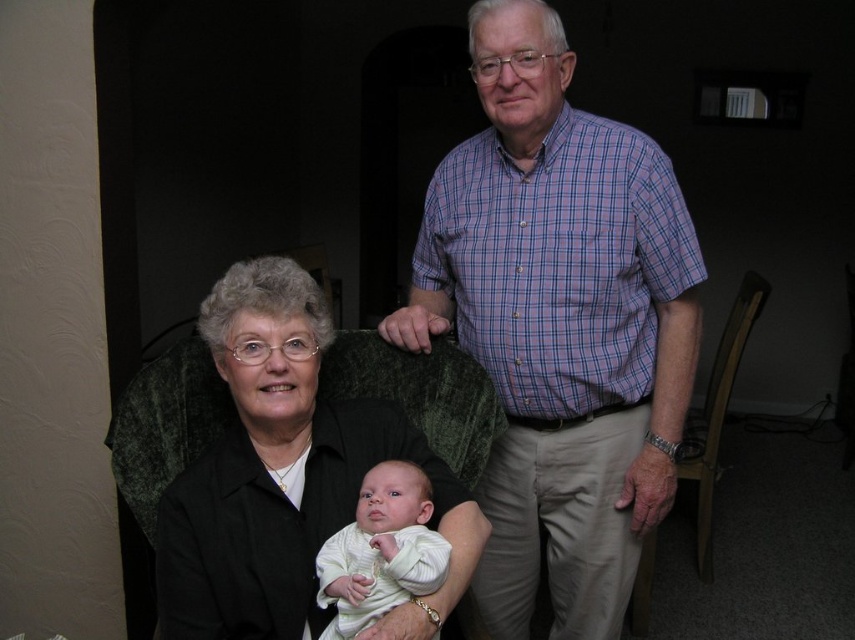
You are a photographer setting up for a family photo. You notice the black fabric at center and the white soft fabric baby at center in the scene. Which fabric is covering the other?

The black fabric at center is positioned over the white soft fabric baby at center, so it is covering it.

You are standing in the living room and want to place a new decorative item at the exact center of the room. The plaid cotton shirt at center is currently located at point (559, 323). Can you confirm if this point is suitable for placing the decorative item?

The plaid cotton shirt at center is located at point (559, 323), so this point is suitable for placing the decorative item as it is already at the center of the room.

You are standing in the living room and want to move from point A to point B. Point A is located at coordinates point (553,264) and point B is at point (346,600). Since you can only move forward, will you be able to walk directly from point A to point B without needing to turn around?

Point (553,264) is further to the viewer than point (346,600). Therefore, moving directly from point A to point B without turning around would require walking away from point B, so you would need to turn around to face point B and then walk towards it.